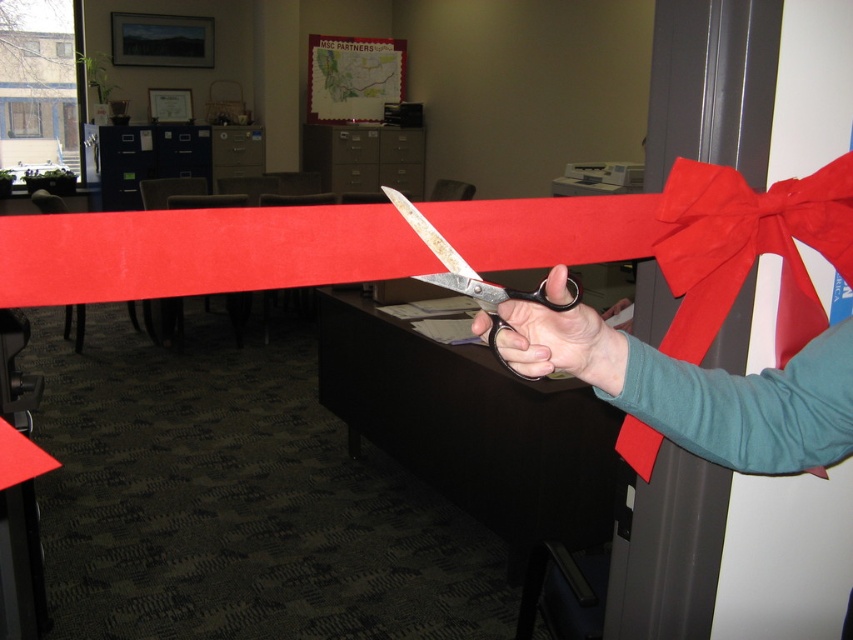
Question: Can you confirm if metallic scissors at center is positioned to the right of matte black scissors at center?

Choices:
 (A) yes
 (B) no

Answer: (A)

Question: Is matte black scissors at center wider than metallic shears at center?

Choices:
 (A) no
 (B) yes

Answer: (A)

Question: Can you confirm if metallic scissors at center is wider than metallic shears at center?

Choices:
 (A) yes
 (B) no

Answer: (A)

Question: Which point is farther to the camera?

Choices:
 (A) (561, 310)
 (B) (581, 376)
 (C) (480, 314)

Answer: (B)

Question: Which object appears farthest from the camera in this image?

Choices:
 (A) metallic scissors at center
 (B) metallic shears at center

Answer: (B)

Question: Which point is closer to the camera?

Choices:
 (A) metallic scissors at center
 (B) matte black scissors at center

Answer: (A)